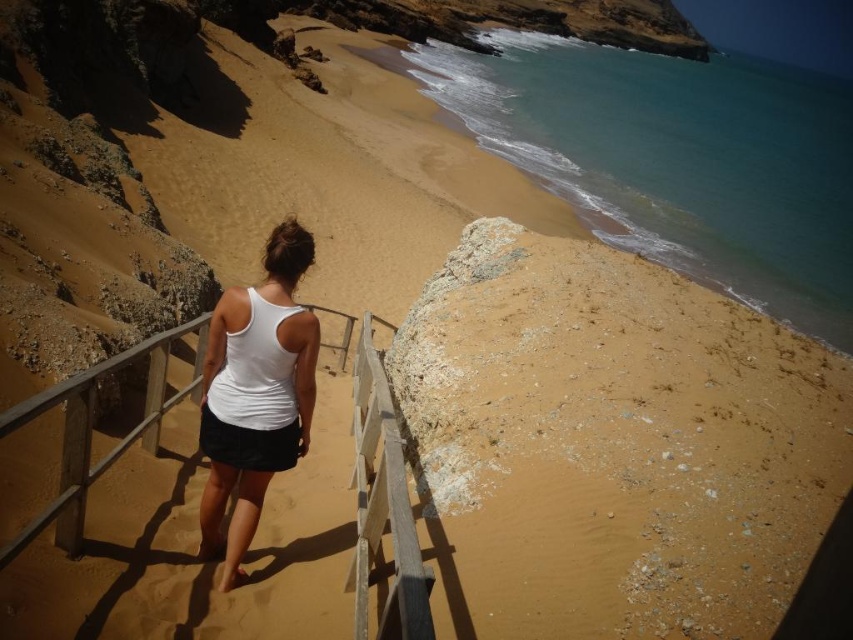
Question: Is brown sandy beach at center closer to camera compared to white matte tank top at center?

Choices:
 (A) yes
 (B) no

Answer: (A)

Question: Is the position of brown sandy beach at center more distant than that of white matte tank top at center?

Choices:
 (A) yes
 (B) no

Answer: (B)

Question: Can you confirm if brown sandy beach at center is wider than white matte tank top at center?

Choices:
 (A) no
 (B) yes

Answer: (A)

Question: Which object appears farthest from the camera in this image?

Choices:
 (A) white matte tank top at center
 (B) brown sandy beach at center

Answer: (A)

Question: Among these objects, which one is farthest from the camera?

Choices:
 (A) brown sandy beach at center
 (B) white matte tank top at center

Answer: (B)

Question: Which point appears closest to the camera in this image?

Choices:
 (A) (271, 442)
 (B) (708, 342)

Answer: (A)